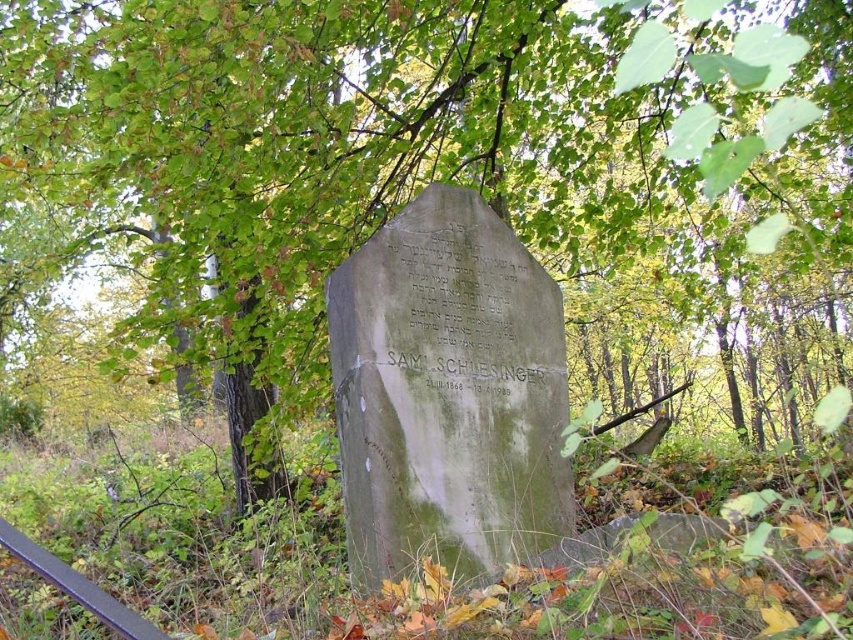
Is green mossy stone at center thinner than metallic rail at lower left?

Incorrect, green mossy stone at center's width is not less than metallic rail at lower left's.

The height and width of the screenshot is (640, 853). I want to click on green mossy stone at center, so click(448, 394).